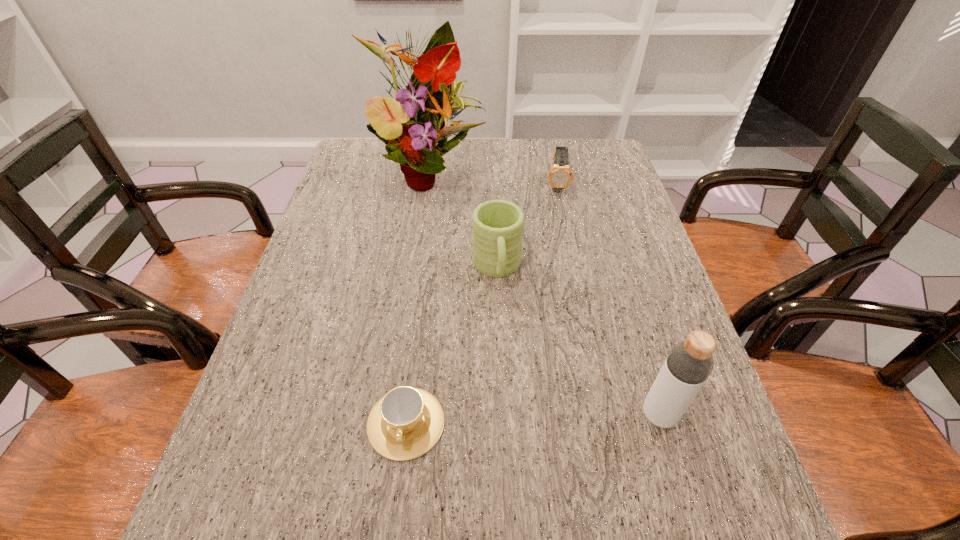
The width and height of the screenshot is (960, 540). I want to click on free space at the far right corner of the desktop, so click(x=593, y=163).

Locate an element on the screen. empty space that is in between the third nearest object and the shortest object is located at coordinates (451, 346).

Locate an element on the screen. This screenshot has width=960, height=540. free spot between the shortest object and the tallest object is located at coordinates (418, 298).

The width and height of the screenshot is (960, 540). I want to click on free area in between the bouquet and the fourth object from left to right, so click(x=492, y=178).

Identify the location of unoccupied area between the second shortest object and the cup. (481, 304).

Image resolution: width=960 pixels, height=540 pixels. Identify the location of free space between the tallest object and the second tallest object. (544, 294).

Find the location of a particular element. blank region between the third nearest object and the rightmost object is located at coordinates (578, 342).

Find the location of a particular element. vacant space in between the tallest object and the mug is located at coordinates (463, 220).

I want to click on unoccupied position between the bouquet and the shortest object, so click(x=418, y=298).

Where is `free spot between the watch and the tallest object`? The height and width of the screenshot is (540, 960). free spot between the watch and the tallest object is located at coordinates (492, 178).